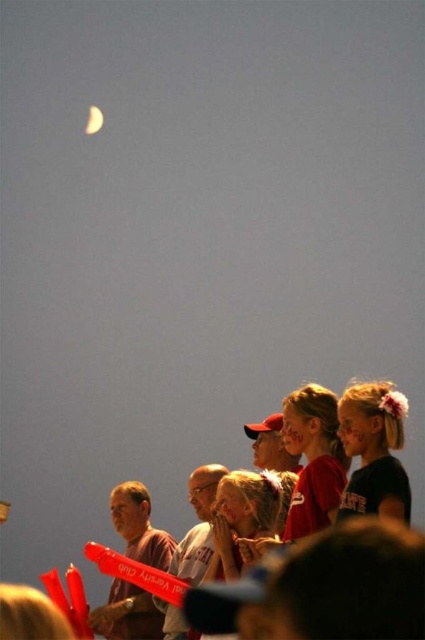
You are standing in the scene and want to find the matte black shirt at lower right. According to the coordinates provided, where should you look relative to the center of the image?

The matte black shirt at lower right is located at point 0.705 on the x axis and 0.880 on the y axis, so you should look to the lower right of the center of the image.

You are standing at the point with coordinates point (88, 113) and want to move towards the point with coordinates point (402, 500). Which direction should you move to reach your destination?

You should move forward because point (402, 500) is in front of point (88, 113).

You are an astronomer observing the scene and need to compare the sizes of the objects in the image. Which object, the matte red shirt at center or the shiny metallic crescent at upper left, has a greater width?

The matte red shirt at center has a greater width than the shiny metallic crescent at upper left.